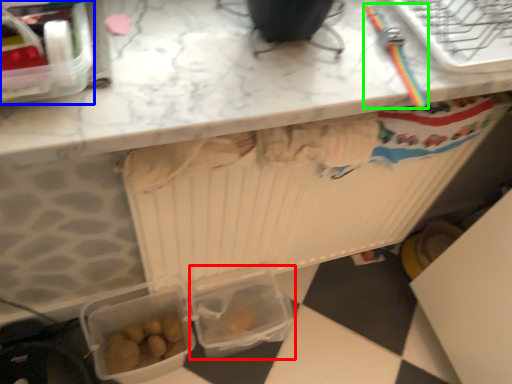
Question: Estimate the real-world distances between objects in this image. Which object is farther from lunch box (highlighted by a red box), lunch box (highlighted by a blue box) or tool (highlighted by a green box)?

Choices:
 (A) lunch box
 (B) tool

Answer: (A)